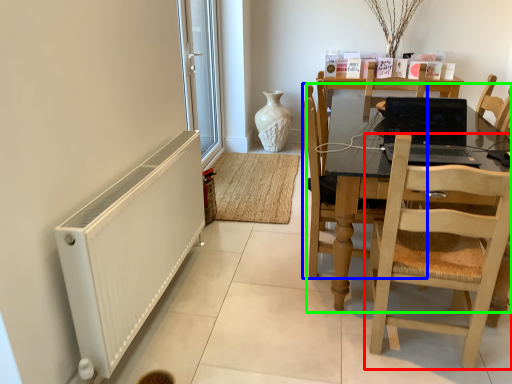
Question: Which object is the closest to the chair (highlighted by a red box)? Choose among these: chair (highlighted by a blue box) or kitchen & dining room table (highlighted by a green box).

Choices:
 (A) chair
 (B) kitchen & dining room table

Answer: (B)